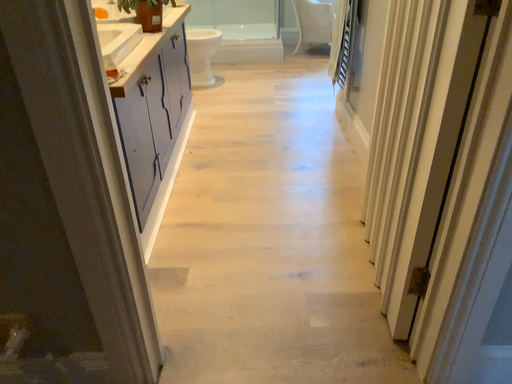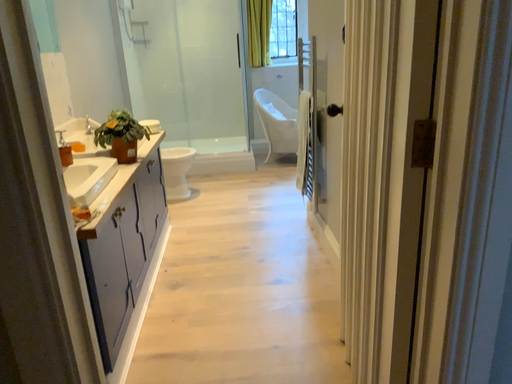
Question: Which way did the camera rotate in the video?

Choices:
 (A) rotated upward
 (B) rotated downward

Answer: (A)